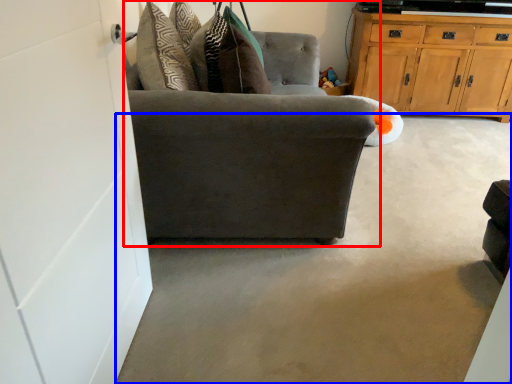
Question: Which object appears closest to the camera in this image, chair (highlighted by a red box) or concrete (highlighted by a blue box)?

Choices:
 (A) chair
 (B) concrete

Answer: (B)